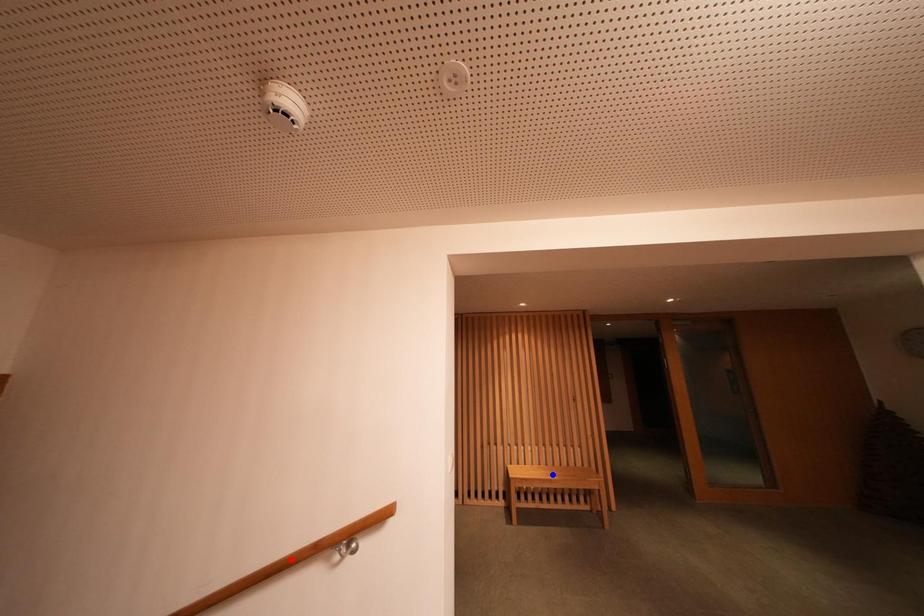
Question: Which of the two points in the image is closer to the camera?

Choices:
 (A) Blue point is closer.
 (B) Red point is closer.

Answer: (B)